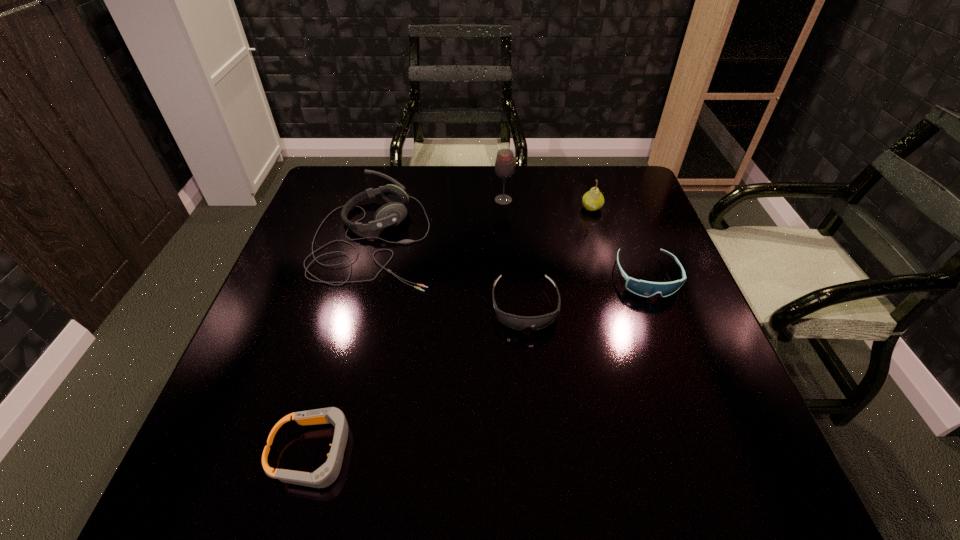
Where is `the third closest object relative to the glass drink container`? The image size is (960, 540). the third closest object relative to the glass drink container is located at coordinates (516, 322).

Identify which goggles is the closest to the headset. Please provide its 2D coordinates. Your answer should be formatted as a tuple, i.e. [(x, y)], where the tuple contains the x and y coordinates of a point satisfying the conditions above.

[(516, 322)]

Identify which goggles is located as the nearest to the second goggles from left to right. Please provide its 2D coordinates. Your answer should be formatted as a tuple, i.e. [(x, y)], where the tuple contains the x and y coordinates of a point satisfying the conditions above.

[(642, 288)]

Find the location of a particular element. free spot that satisfies the following two spatial constraints: 1. on the front side of the glass drink container; 2. on the front and back of the nearest goggles is located at coordinates (519, 453).

You are a GUI agent. You are given a task and a screenshot of the screen. Output one action in this format:
    pyautogui.click(x=<x>, y=<y>)
    Task: Click on the blank space that satisfies the following two spatial constraints: 1. on the front-facing side of the rightmost goggles; 2. on the front and back of the leftmost goggles
    
    Given the screenshot: What is the action you would take?
    pyautogui.click(x=713, y=453)

At what (x,y) coordinates should I click in order to perform the action: click on free point that satisfies the following two spatial constraints: 1. on the front side of the glass drink container; 2. on the front and back of the nearest object. Please return your answer as a coordinate pair (x, y). The image size is (960, 540). Looking at the image, I should click on (519, 453).